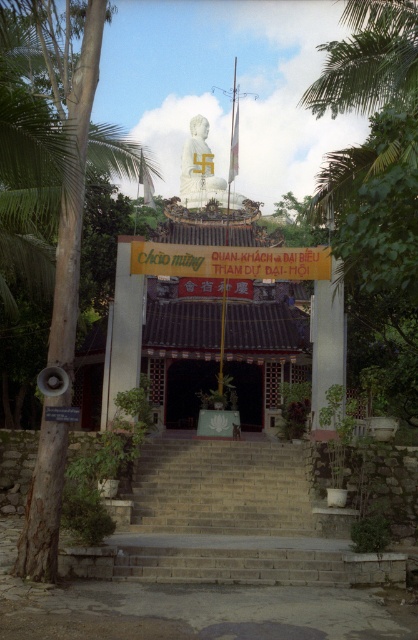
You are a tourist standing at the wooden gate at center, and you want to reach the white marble statue at center. The path between them is straight. If you walk at a speed of 3 feet per second, how many seconds will it take you to reach the statue?

The distance between the wooden gate at center and the white marble statue at center is 151.17 feet. At a walking speed of 3 feet per second, dividing the distance by the speed gives 151.17 divided by 3 equals approximately 50.39 seconds. Rounding to the nearest whole number, it would take about 50 seconds to reach the statue.

You are a tourist standing at the entrance of the temple. You see the stone stairs at center and the wooden gate at center. Which one is more to the left?

The wooden gate at center is more to the left because the stone stairs at center is positioned on the right side of wooden gate at center.

You are standing at the entrance of the temple and want to place a small offering at the point that is closer to the Buddha statue. Which point should you choose between point (306, 582) and point (201, 180)?

Point (201, 180) is closer to the Buddha statue because it is behind point (306, 582). Since the Buddha statue is at the top of the building, the point closer to it would be the one further back in the scene. Therefore, you should choose point (201, 180) for placing the offering.